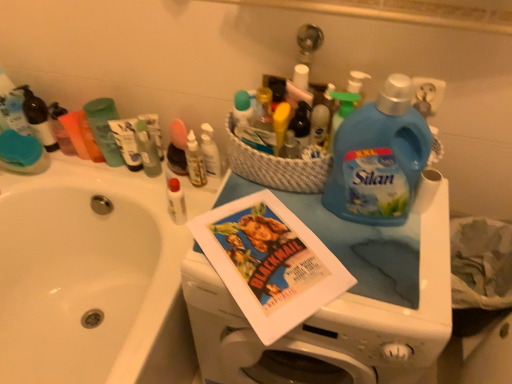
The image size is (512, 384). Identify the location of vacant space in front of white paper at right. pyautogui.click(x=413, y=259).